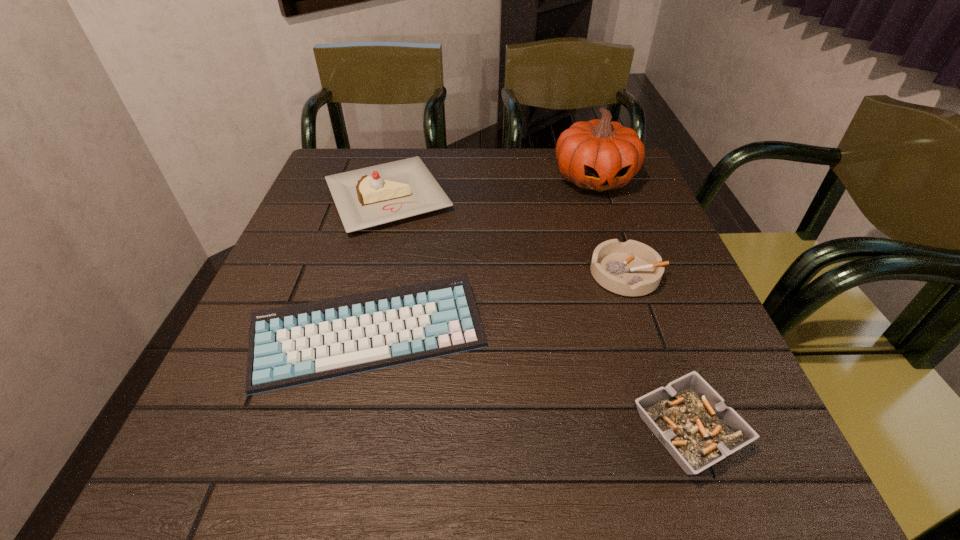
Where is `vacant position at the left edge of the desktop`? This screenshot has height=540, width=960. vacant position at the left edge of the desktop is located at coordinates (314, 207).

The height and width of the screenshot is (540, 960). What are the coordinates of `vacant area at the right edge of the desktop` in the screenshot? It's located at pos(722,384).

You are a GUI agent. You are given a task and a screenshot of the screen. Output one action in this format:
    pyautogui.click(x=<x>, y=<y>)
    Task: Click on the free space at the far left corner of the desktop
    The width and height of the screenshot is (960, 540).
    Given the screenshot: What is the action you would take?
    pyautogui.click(x=319, y=192)

Where is `blank space at the far right corner of the desktop`? The height and width of the screenshot is (540, 960). blank space at the far right corner of the desktop is located at coordinates (587, 193).

Where is `free space between the computer keyboard and the tallest object`? The height and width of the screenshot is (540, 960). free space between the computer keyboard and the tallest object is located at coordinates (482, 257).

Find the location of `vacant space that's between the nearer ashtray and the computer keyboard`. vacant space that's between the nearer ashtray and the computer keyboard is located at coordinates (529, 383).

I want to click on vacant space in between the computer keyboard and the farther ashtray, so click(x=498, y=305).

Locate an element on the screen. The width and height of the screenshot is (960, 540). vacant area that lies between the cake and the nearer ashtray is located at coordinates (538, 313).

This screenshot has width=960, height=540. In order to click on vacant area that lies between the cake and the farther ashtray in this screenshot , I will do `click(507, 235)`.

Find the location of a particular element. This screenshot has height=540, width=960. free space between the second tallest object and the computer keyboard is located at coordinates (378, 266).